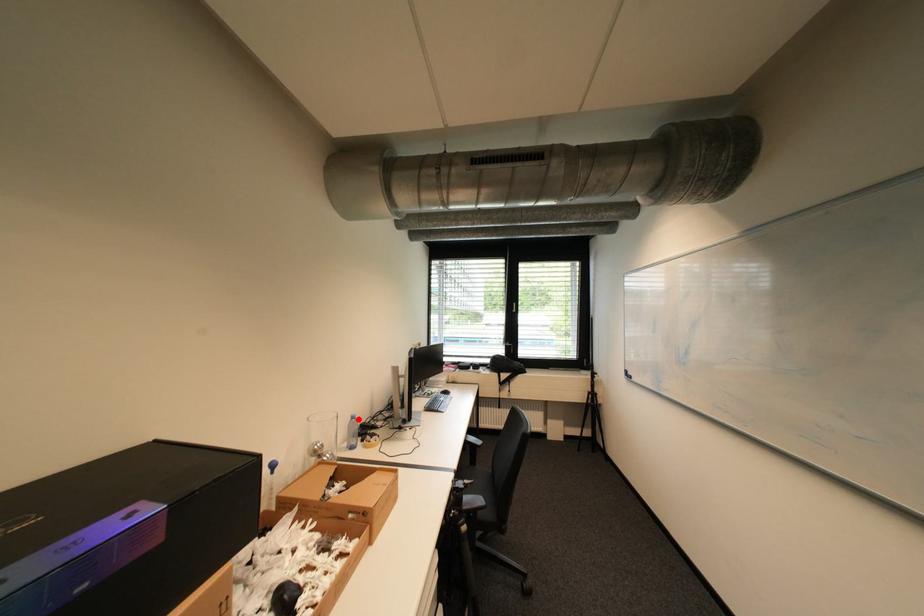
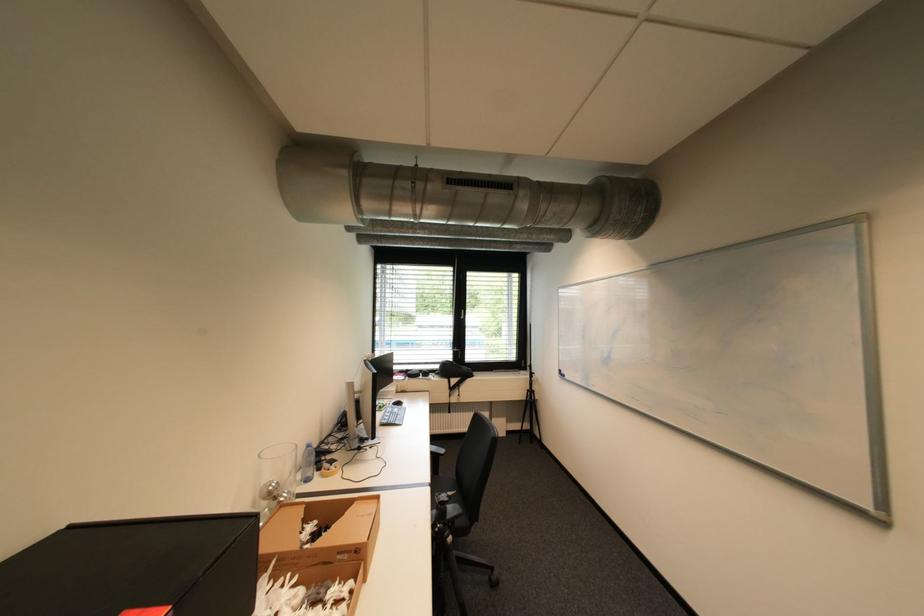
Where in the second image is the point corresponding to the highlighted location from the first image?

(313, 448)